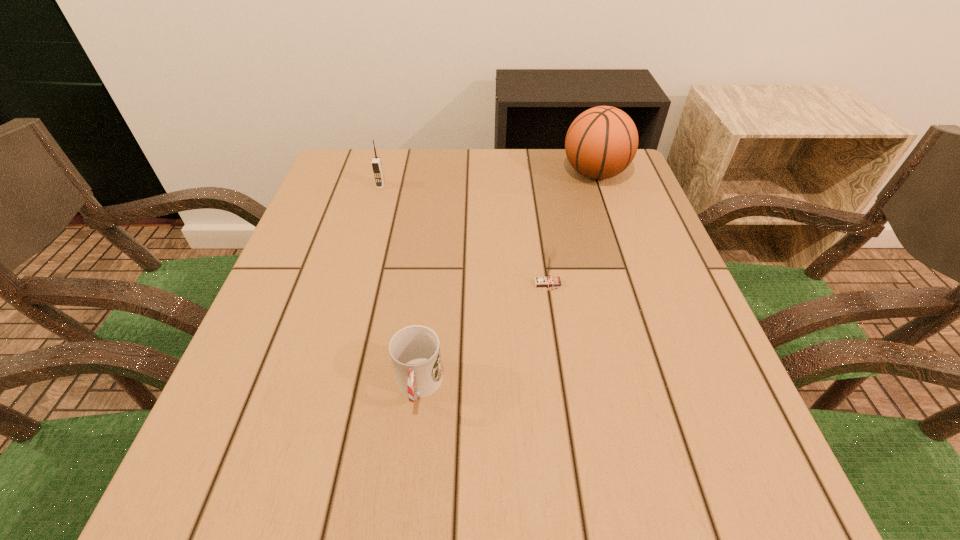
Identify the location of free space between the cup and the third object from left to right. This screenshot has height=540, width=960. (483, 335).

Choose which object is the third nearest neighbor to the matchbox. Please provide its 2D coordinates. Your answer should be formatted as a tuple, i.e. [(x, y)], where the tuple contains the x and y coordinates of a point satisfying the conditions above.

[(376, 162)]

In order to click on object that ranks as the closest to the matchbox in this screenshot , I will do `click(415, 350)`.

The width and height of the screenshot is (960, 540). In order to click on free space that satisfies the following two spatial constraints: 1. on the front-facing side of the third farthest object; 2. on the right side of the leftmost object in this screenshot , I will do `click(352, 285)`.